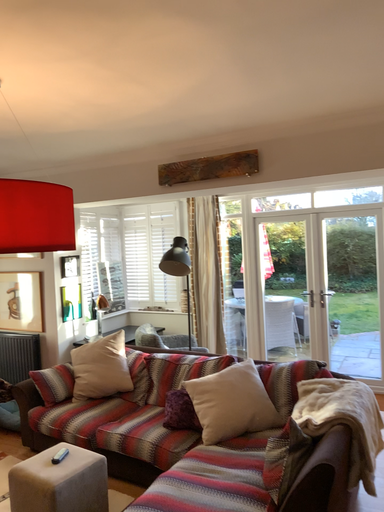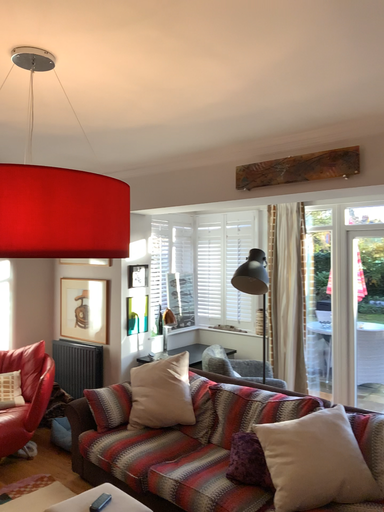
Question: How did the camera likely rotate when shooting the video?

Choices:
 (A) rotated left
 (B) rotated right

Answer: (A)